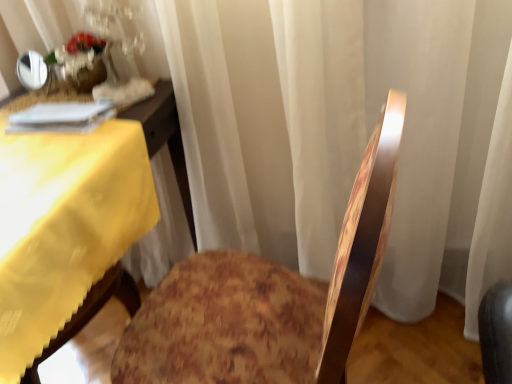
Question: Looking at the image, does yellow fabric table at left seem bigger or smaller compared to wooden floral-patterned chair at center?

Choices:
 (A) small
 (B) big

Answer: (A)

Question: Is yellow fabric table at left wider or thinner than wooden floral-patterned chair at center?

Choices:
 (A) thin
 (B) wide

Answer: (B)

Question: Based on their relative distances, which object is nearer to the wooden floral-patterned chair at center?

Choices:
 (A) translucent glass vase at upper left
 (B) yellow fabric table at left

Answer: (B)

Question: Which object is positioned farthest from the wooden floral-patterned chair at center?

Choices:
 (A) yellow fabric table at left
 (B) translucent glass vase at upper left

Answer: (B)